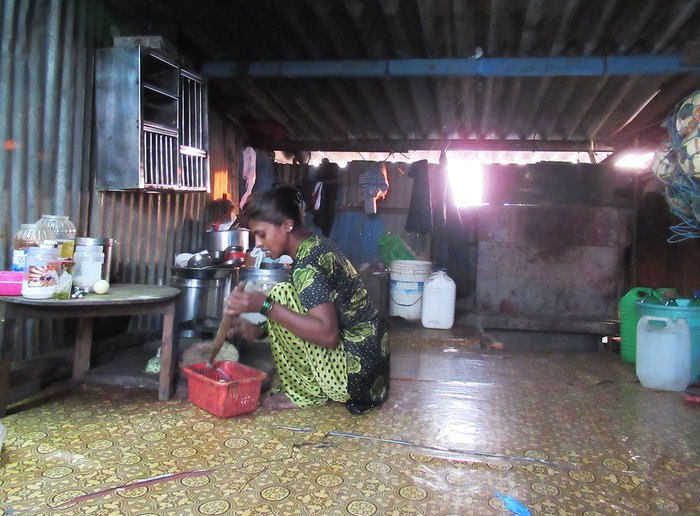
Image resolution: width=700 pixels, height=516 pixels. What are the coordinates of `floor` in the screenshot? It's located at (341, 479).